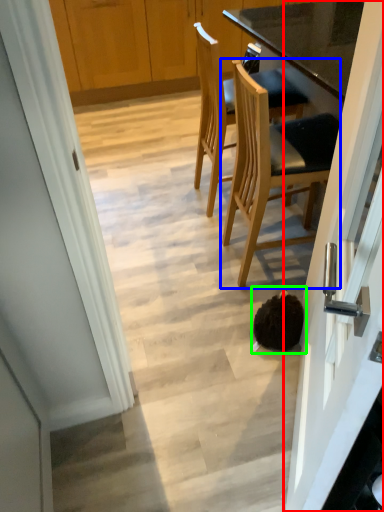
Question: Estimate the real-world distances between objects in this image. Which object is farther from door (highlighted by a red box), chair (highlighted by a blue box) or head (highlighted by a green box)?

Choices:
 (A) chair
 (B) head

Answer: (A)